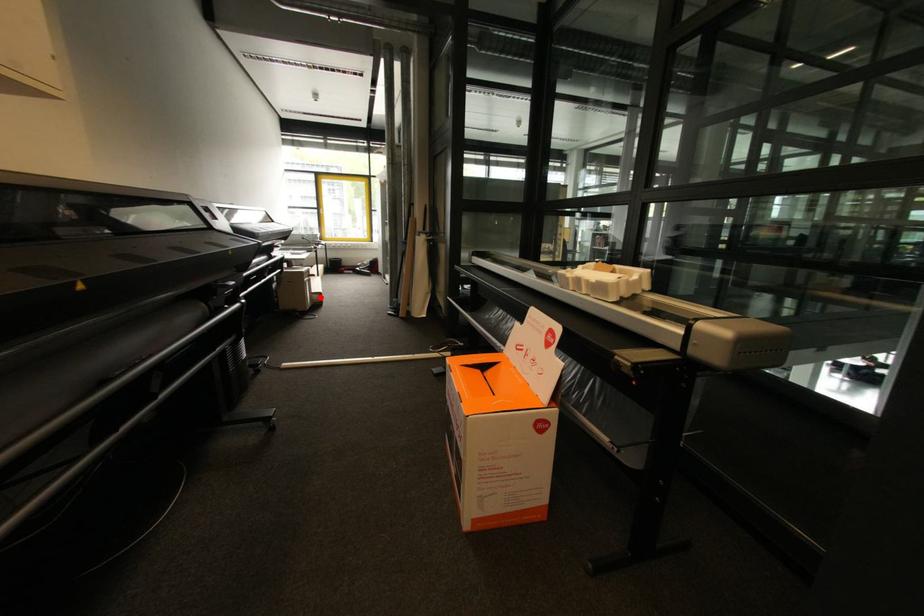
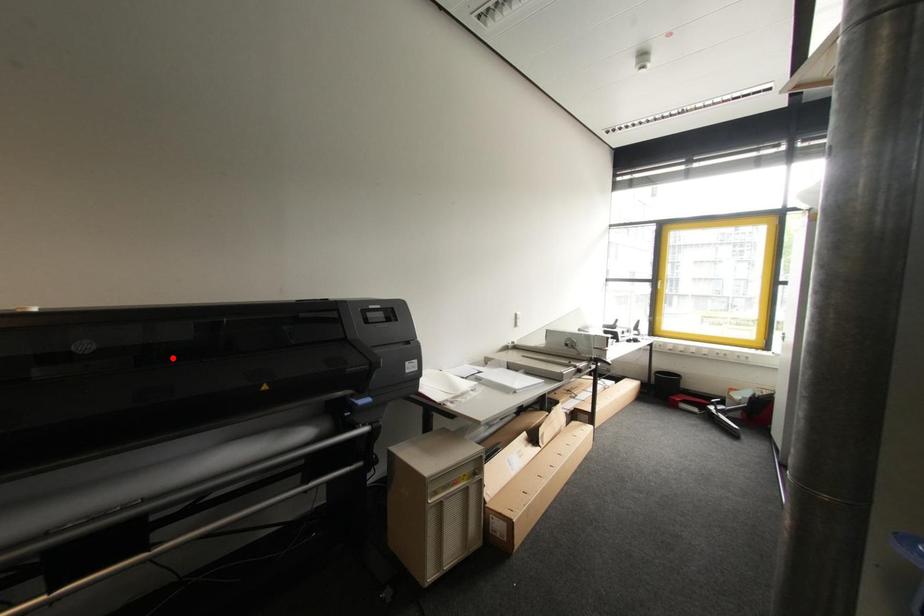
I am providing you with two images of the same scene from different viewpoints. A red point is marked on the first image and another point is marked on the second image. Does the point marked in image1 correspond to the same location as the one in image2?

No